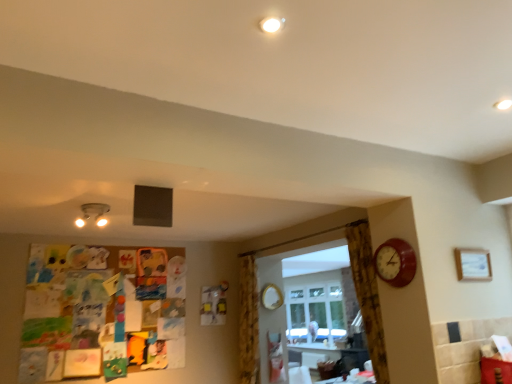
Question: Is matte white lamp at upper left aimed at wooden picture frame at upper right?

Choices:
 (A) yes
 (B) no

Answer: (B)

Question: Is wooden picture frame at upper right a part of matte white lamp at upper left?

Choices:
 (A) no
 (B) yes

Answer: (A)

Question: Is matte white lamp at upper left outside wooden picture frame at upper right?

Choices:
 (A) yes
 (B) no

Answer: (A)

Question: Is the position of matte white lamp at upper left more distant than that of wooden picture frame at upper right?

Choices:
 (A) yes
 (B) no

Answer: (A)

Question: Is matte white lamp at upper left not near wooden picture frame at upper right?

Choices:
 (A) no
 (B) yes

Answer: (B)

Question: Is matte white lamp at upper left taller than wooden picture frame at upper right?

Choices:
 (A) yes
 (B) no

Answer: (B)

Question: From a real-world perspective, is wooden clock at right positioned under matte white lamp at upper left based on gravity?

Choices:
 (A) yes
 (B) no

Answer: (A)

Question: Considering the relative sizes of wooden clock at right and matte white lamp at upper left in the image provided, is wooden clock at right wider than matte white lamp at upper left?

Choices:
 (A) no
 (B) yes

Answer: (A)

Question: From the image's perspective, does wooden clock at right appear lower than matte white lamp at upper left?

Choices:
 (A) yes
 (B) no

Answer: (A)

Question: Considering the relative sizes of wooden clock at right and matte white lamp at upper left in the image provided, is wooden clock at right shorter than matte white lamp at upper left?

Choices:
 (A) yes
 (B) no

Answer: (B)

Question: Considering the relative sizes of wooden clock at right and matte white lamp at upper left in the image provided, is wooden clock at right taller than matte white lamp at upper left?

Choices:
 (A) no
 (B) yes

Answer: (B)

Question: Is wooden clock at right further to the viewer compared to matte white lamp at upper left?

Choices:
 (A) yes
 (B) no

Answer: (B)

Question: Would you consider wooden picture frame at upper right to be distant from yellow floral fabric curtain at center, the second curtain positioned from the front?

Choices:
 (A) no
 (B) yes

Answer: (B)